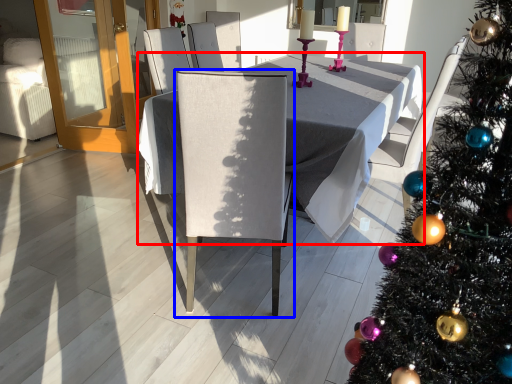
Question: Which object appears farthest to the camera in this image, table (highlighted by a red box) or chair (highlighted by a blue box)?

Choices:
 (A) table
 (B) chair

Answer: (A)